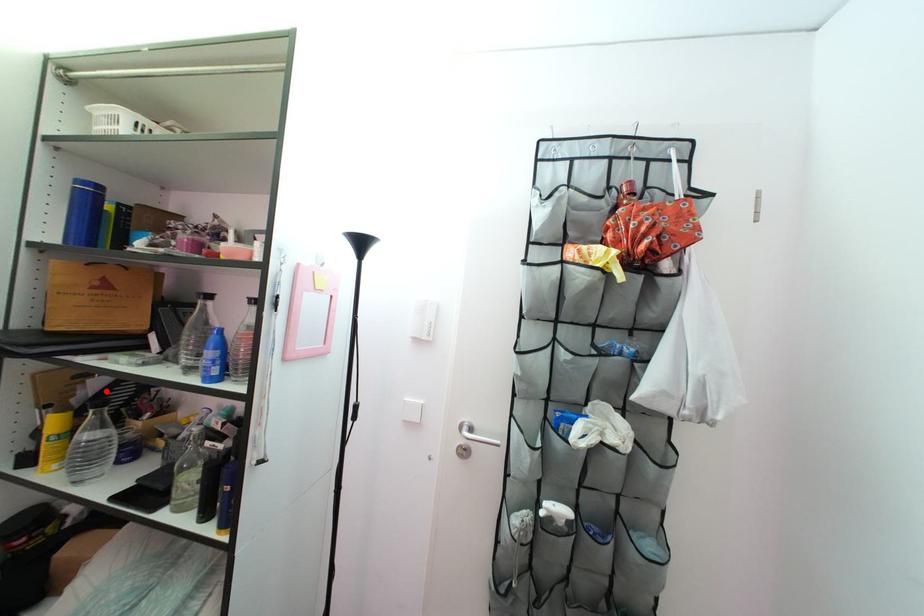
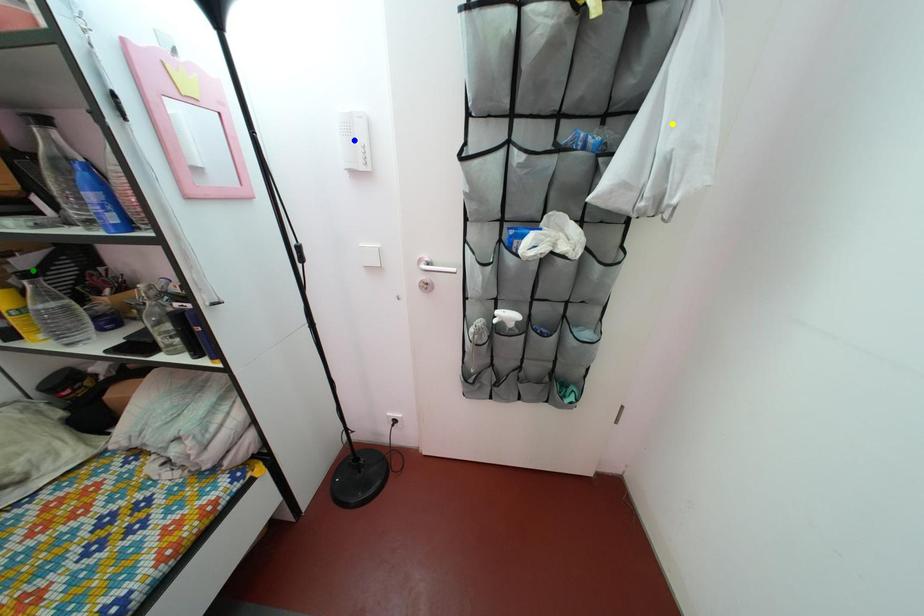
Question: I am providing you with two images of the same scene from different viewpoints. A red point is marked on the first image. You are given multiple points on the second image. Which point in image 2 is actually the same real-world point as the red point in image 1?

Choices:
 (A) green point
 (B) yellow point
 (C) blue point

Answer: (A)